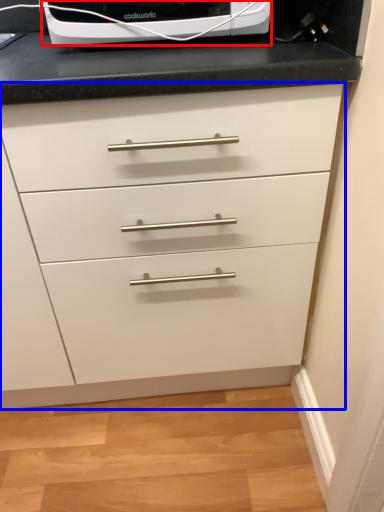
Question: Which object appears closest to the camera in this image, home appliance (highlighted by a red box) or chest of drawers (highlighted by a blue box)?

Choices:
 (A) home appliance
 (B) chest of drawers

Answer: (B)